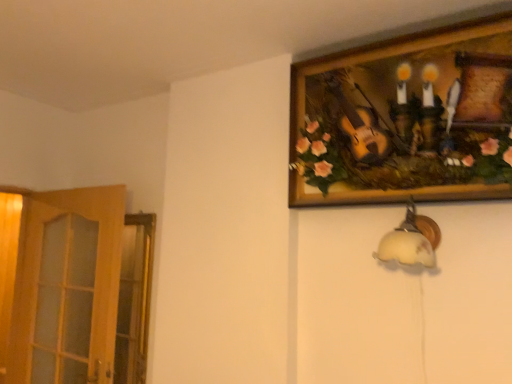
Question: From the image's perspective, relative to wooden at left, is white frosted glass lampshade at lower right above or below?

Choices:
 (A) below
 (B) above

Answer: (B)

Question: Is point (382, 243) positioned closer to the camera than point (76, 354)?

Choices:
 (A) closer
 (B) farther

Answer: (A)

Question: Estimate the real-world distances between objects in this image. Which object is closer to the white frosted glass lampshade at lower right?

Choices:
 (A) wooden picture frame at upper right
 (B) wooden at left

Answer: (A)

Question: Estimate the real-world distances between objects in this image. Which object is farther from the wooden picture frame at upper right?

Choices:
 (A) white frosted glass lampshade at lower right
 (B) wooden at left

Answer: (B)